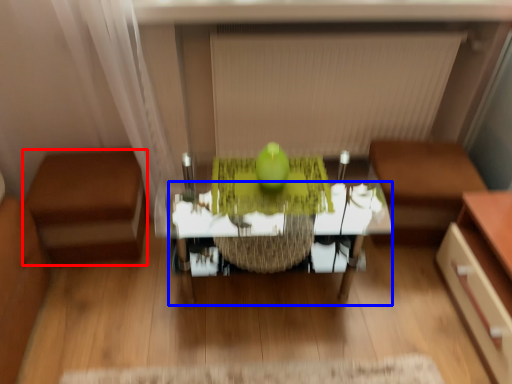
Question: Which object is closer to the camera taking this photo, furniture (highlighted by a red box) or table (highlighted by a blue box)?

Choices:
 (A) furniture
 (B) table

Answer: (B)